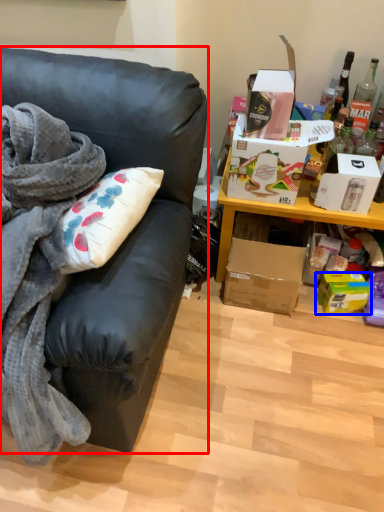
Question: Among these objects, which one is farthest to the camera, studio couch (highlighted by a red box) or box (highlighted by a blue box)?

Choices:
 (A) studio couch
 (B) box

Answer: (B)